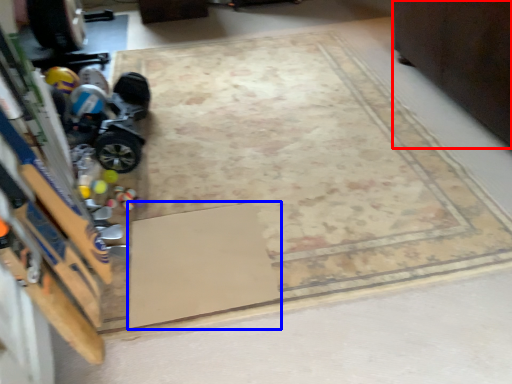
Question: Which of the following is the farthest to the observer, furniture (highlighted by a red box) or doormat (highlighted by a blue box)?

Choices:
 (A) furniture
 (B) doormat

Answer: (A)